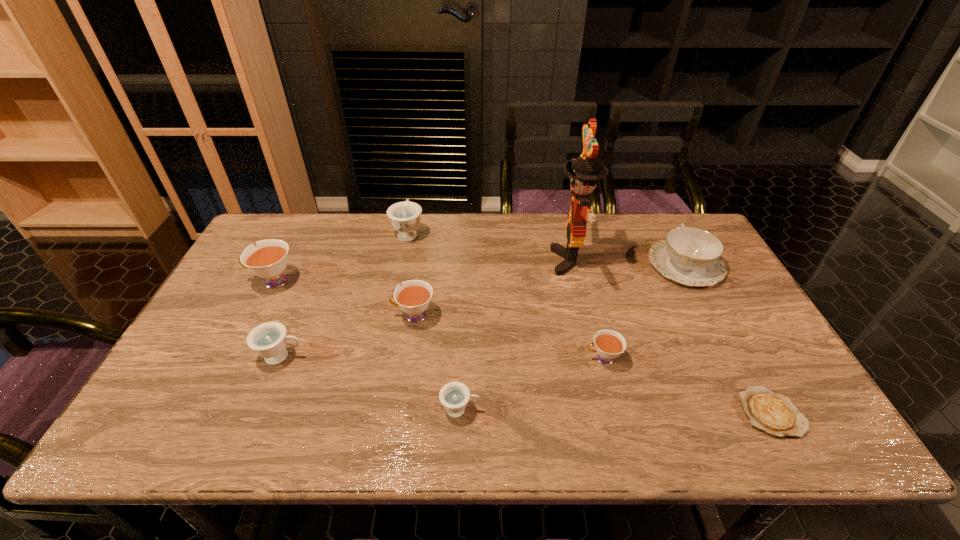
Where is `free space located 0.330m on the side of the nearest blue teacup with the handle`? The height and width of the screenshot is (540, 960). free space located 0.330m on the side of the nearest blue teacup with the handle is located at coordinates (624, 410).

This screenshot has width=960, height=540. I want to click on free location located on the back of the quiche, so click(732, 340).

You are a GUI agent. You are given a task and a screenshot of the screen. Output one action in this format:
    pyautogui.click(x=<x>, y=<y>)
    Task: Click on the nutcracker that is at the far edge
    The height and width of the screenshot is (540, 960).
    Given the screenshot: What is the action you would take?
    pyautogui.click(x=584, y=171)

Locate an element on the screen. Image resolution: width=960 pixels, height=540 pixels. teacup present at the far edge is located at coordinates (405, 216).

Where is `chinaware that is at the far edge`? chinaware that is at the far edge is located at coordinates (690, 256).

This screenshot has width=960, height=540. Identify the location of teacup present at the near edge. (454, 396).

Identify the location of quiche present at the near edge. (773, 413).

The image size is (960, 540). Identify the location of object positioned at the left edge. (269, 259).

In order to click on chinaware present at the right edge in this screenshot , I will do `click(690, 256)`.

Where is `quiche situated at the right edge`? quiche situated at the right edge is located at coordinates (773, 413).